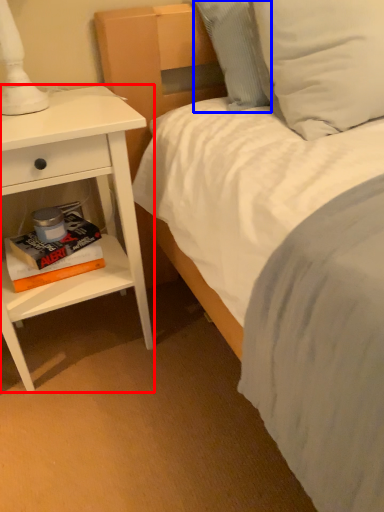
Question: Which of the following is the closest to the observer, nightstand (highlighted by a red box) or pillow (highlighted by a blue box)?

Choices:
 (A) nightstand
 (B) pillow

Answer: (A)